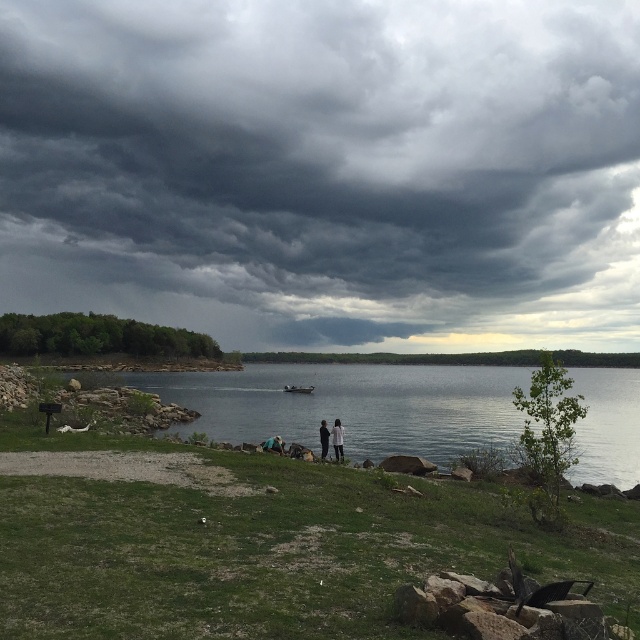
Does dark gray fabric couple at center appear under light brown leather jacket at center?

Yes.

Describe the element at coordinates (332, 438) in the screenshot. I see `dark gray fabric couple at center` at that location.

The height and width of the screenshot is (640, 640). In order to click on dark gray fabric couple at center in this screenshot , I will do `click(332, 438)`.

Who is more forward, (321, 442) or (326, 448)?

Answer: Positioned in front is point (321, 442).

Which is behind, point (337, 438) or point (321, 420)?

The point (321, 420) is behind.

Is point (340, 426) positioned before point (326, 436)?

Yes.

At what (x,y) coordinates should I click in order to perform the action: click on dark gray fabric couple at center. Please return your answer as a coordinate pair (x, y). Looking at the image, I should click on (332, 438).

Who is positioned more to the right, dark gray cloud at upper center or dark gray fabric couple at center?

dark gray fabric couple at center

What do you see at coordinates (326, 170) in the screenshot? The image size is (640, 640). I see `dark gray cloud at upper center` at bounding box center [326, 170].

Which is in front, point (528, 260) or point (324, 440)?

Positioned in front is point (324, 440).

Find the location of a particular element. dark gray cloud at upper center is located at coordinates (326, 170).